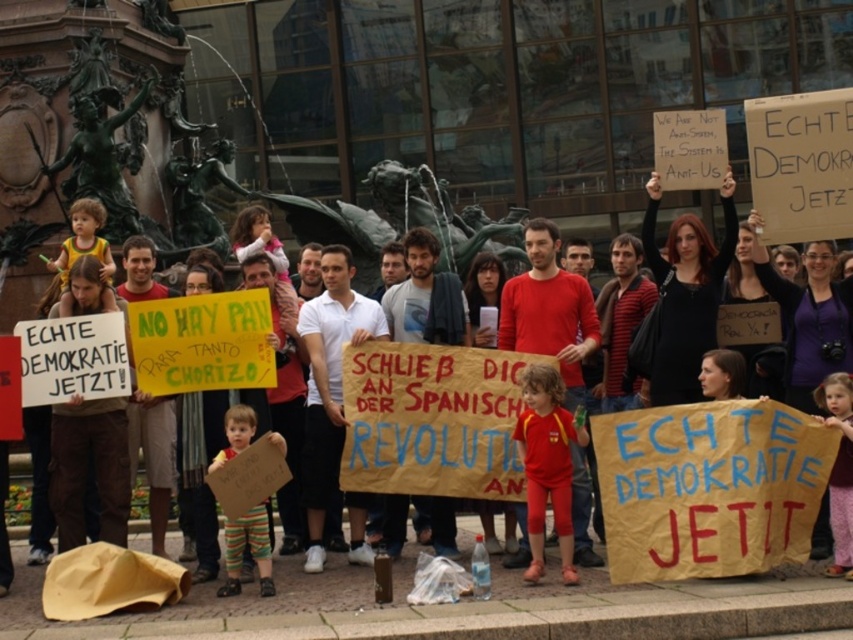
You are a photographer standing in the crowd at the protest. You want to take a photo of the striped cotton pants at lower center and the dusty pink fabric at lower right. Which object should you focus on first to ensure both are in clear view?

You should focus on the striped cotton pants at lower center first because it is closer to you than the dusty pink fabric at lower right, so focusing on it will also keep the dusty pink fabric at lower right in focus if they are within the same depth of field.

You are a photographer at the protest and want to capture the dusty pink fabric at lower right in your shot. Where exactly should you position your camera to ensure it is centered in the frame?

To center the dusty pink fabric at lower right in your frame, position your camera so that its center aligns with the coordinates point at approximately 0.733 on the horizontal axis and 0.985 on the vertical axis.

Where is the striped cotton pants at lower center located in the image?

The striped cotton pants at lower center is located at point [248,548].